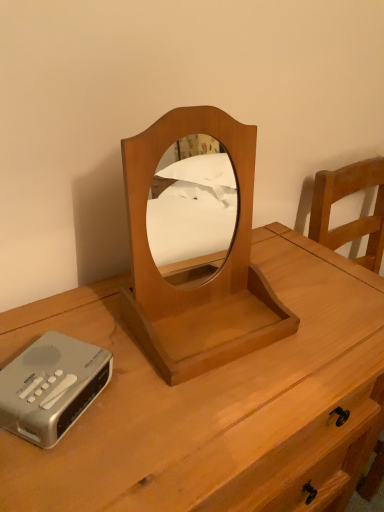
At what (x,y) coordinates should I click in order to perform the action: click on vacant space that is to the left of wooden mirror at center. Please return your answer as a coordinate pair (x, y). Looking at the image, I should click on (87, 318).